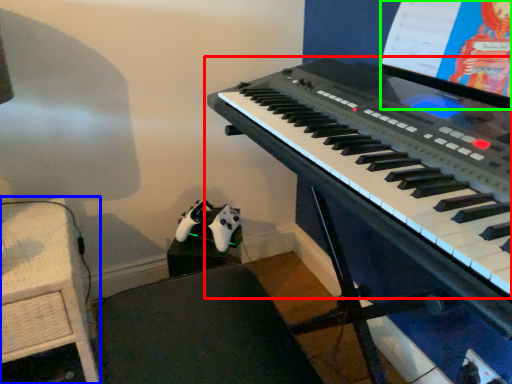
Question: Which object is the closest to the musical keyboard (highlighted by a red box)? Choose among these: table (highlighted by a blue box) or computer screen (highlighted by a green box).

Choices:
 (A) table
 (B) computer screen

Answer: (B)